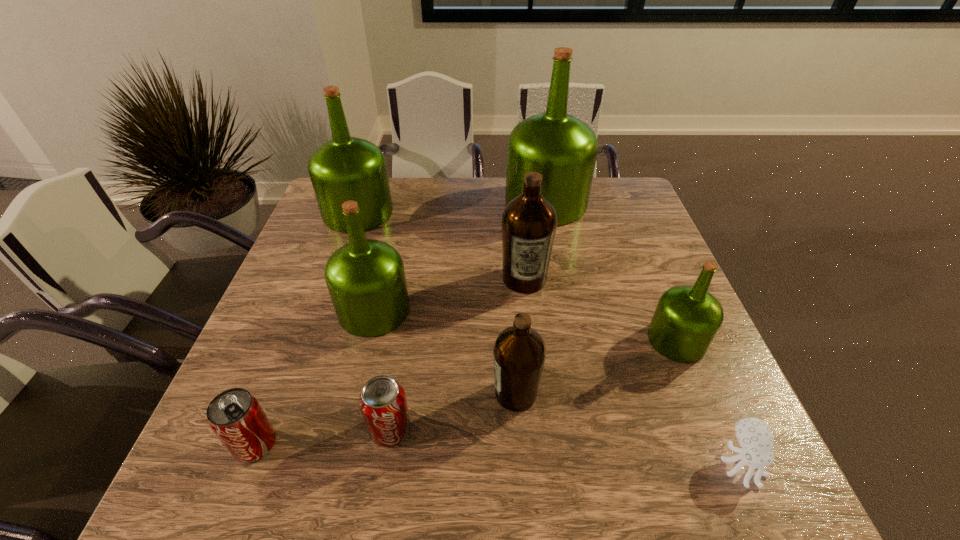
You are a GUI agent. You are given a task and a screenshot of the screen. Output one action in this format:
    pyautogui.click(x=<x>, y=<y>)
    Task: Click on the free location located 0.220m on the label of the nearest olive oil
    
    Given the screenshot: What is the action you would take?
    [x=383, y=394]

This screenshot has height=540, width=960. Find the location of `vacant area situated 0.370m on the label of the nearest olive oil`. vacant area situated 0.370m on the label of the nearest olive oil is located at coordinates point(308,394).

At what (x,y) coordinates should I click in order to perform the action: click on free space located 0.170m on the right of the red pop soda. Please return your answer as a coordinate pair (x, y). Looking at the image, I should click on (369, 444).

I want to click on free point located 0.180m on the left of the right soda can, so click(274, 429).

Locate an element on the screen. The height and width of the screenshot is (540, 960). pop soda situated at the near edge is located at coordinates (236, 417).

Where is `octopus that is at the near edge`? octopus that is at the near edge is located at coordinates (754, 435).

Locate an element on the screen. The height and width of the screenshot is (540, 960). olive oil that is at the left edge is located at coordinates (345, 168).

Where is `pop soda at the left edge`? The height and width of the screenshot is (540, 960). pop soda at the left edge is located at coordinates (236, 417).

You are a GUI agent. You are given a task and a screenshot of the screen. Output one action in this format:
    pyautogui.click(x=<x>, y=<y>)
    Task: Click on the olive oil at the right edge
    The width and height of the screenshot is (960, 540).
    Given the screenshot: What is the action you would take?
    pyautogui.click(x=687, y=318)

Identify the location of octopus that is at the right edge. This screenshot has height=540, width=960. (754, 435).